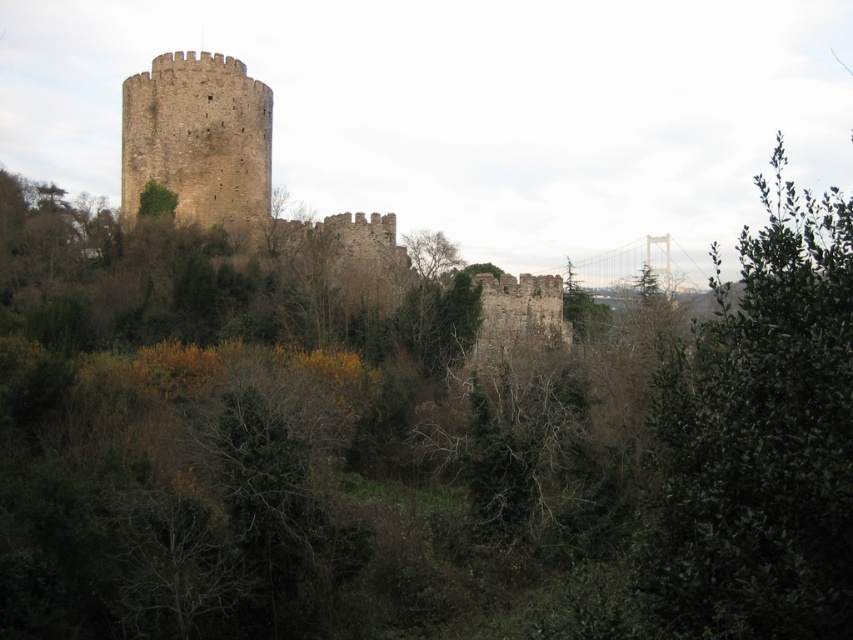
How much distance is there between green leafy tree at right and brown stone tower at center?

green leafy tree at right is 236.62 feet away from brown stone tower at center.

Can you confirm if green leafy tree at right is positioned to the right of brown stone tower at center?

Correct, you'll find green leafy tree at right to the right of brown stone tower at center.

Which is in front, point (683, 474) or point (170, 148)?

Point (683, 474) is more forward.

The width and height of the screenshot is (853, 640). What are the coordinates of `green leafy tree at right` in the screenshot? It's located at (759, 440).

What do you see at coordinates (759, 440) in the screenshot? I see `green leafy tree at right` at bounding box center [759, 440].

Does green leafy tree at right appear on the right side of brown stone tower at center-left?

Yes, green leafy tree at right is to the right of brown stone tower at center-left.

Image resolution: width=853 pixels, height=640 pixels. Identify the location of green leafy tree at right. (759, 440).

Is point (256, 84) more distant than point (125, 104)?

Yes, it is.

Which is below, brown stone tower at center-left or brown stone tower at center?

brown stone tower at center-left is lower down.

You are a GUI agent. You are given a task and a screenshot of the screen. Output one action in this format:
    pyautogui.click(x=<x>, y=<y>)
    Task: Click on the brown stone tower at center-left
    
    Given the screenshot: What is the action you would take?
    (221, 154)